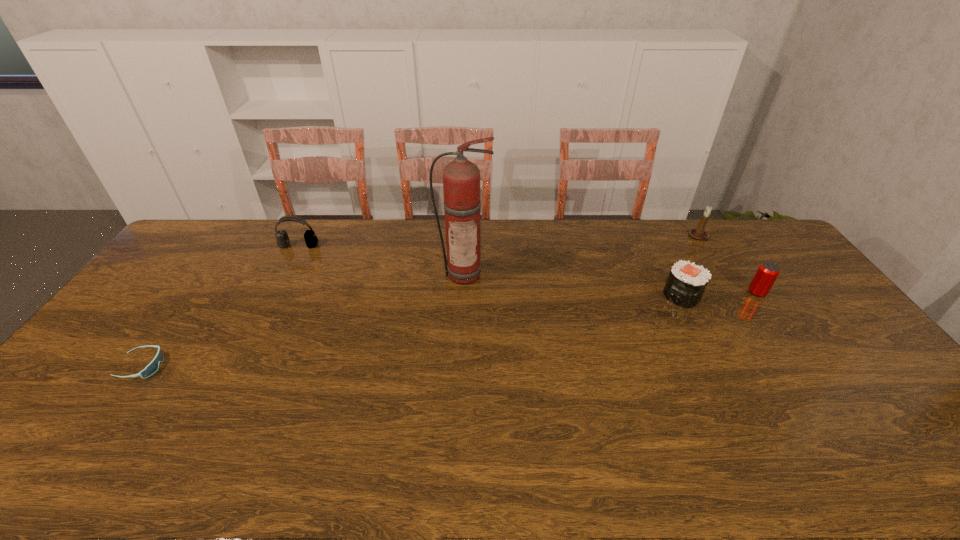
At what (x,y) coordinates should I click in order to perform the action: click on free point between the sushi and the can. Please return your answer as a coordinate pair (x, y). Looking at the image, I should click on (720, 294).

In order to click on object that stands as the second closest to the shortest object in this screenshot , I will do [x=461, y=178].

Find the location of a particular element. The height and width of the screenshot is (540, 960). object that is the third closest to the tallest object is located at coordinates (700, 234).

At what (x,y) coordinates should I click in order to perform the action: click on vacant space that satisfies the following two spatial constraints: 1. on the side of the can with the label and nozzle; 2. on the right side of the fire extinguisher. Please return your answer as a coordinate pair (x, y). Looking at the image, I should click on (464, 293).

Find the location of a particular element. The image size is (960, 540). vacant space that satisfies the following two spatial constraints: 1. on the headband of the headset; 2. on the left side of the can is located at coordinates (275, 293).

The width and height of the screenshot is (960, 540). What are the coordinates of `free location that satisfies the following two spatial constraints: 1. on the headband of the can; 2. on the left side of the headset` in the screenshot? It's located at (275, 293).

The image size is (960, 540). In order to click on free space that satisfies the following two spatial constraints: 1. on the side of the candle holder with the handle; 2. on the front-facing side of the shortest object in this screenshot , I will do pos(781,366).

At what (x,y) coordinates should I click in order to perform the action: click on vacant region that satisfies the following two spatial constraints: 1. on the headband of the can; 2. on the left side of the headset. Please return your answer as a coordinate pair (x, y). This screenshot has height=540, width=960. Looking at the image, I should click on (275, 293).

Identify the location of free location that satisfies the following two spatial constraints: 1. on the side of the third object from left to right with the label and nozzle; 2. on the front-facing side of the nearest object. (461, 366).

This screenshot has width=960, height=540. In order to click on free space that satisfies the following two spatial constraints: 1. on the headband of the fifth object from right to left; 2. on the front-facing side of the nearest object in this screenshot , I will do `click(237, 366)`.